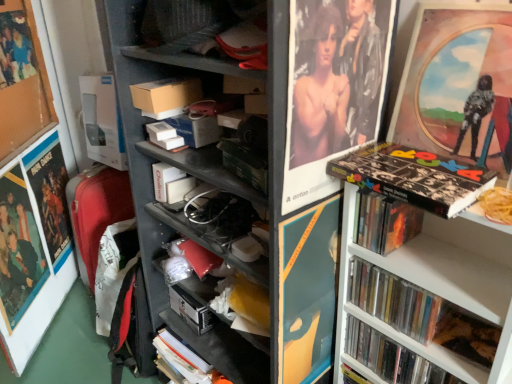
This screenshot has width=512, height=384. What do you see at coordinates (190, 310) in the screenshot?
I see `hardcover book at center` at bounding box center [190, 310].

In order to face wooden frame poster at upper left, placed as the 3th poster page when sorted from right to left, should I rotate leftwards or rightwards?

A 29.565 degree turn to the left will do.

Describe the element at coordinates (22, 82) in the screenshot. I see `wooden frame poster at upper left, placed as the 3th poster page when sorted from right to left` at that location.

Image resolution: width=512 pixels, height=384 pixels. I want to click on white matte book at center, the fifth book viewed from the right, so click(x=170, y=183).

Image resolution: width=512 pixels, height=384 pixels. What do you see at coordinates (170, 183) in the screenshot?
I see `white matte book at center, the fifth book viewed from the right` at bounding box center [170, 183].

What do you see at coordinates (384, 222) in the screenshot? Image resolution: width=512 pixels, height=384 pixels. I see `hardcover book at upper right, which is the fourth book from right to left` at bounding box center [384, 222].

Locate an element on the screen. The width and height of the screenshot is (512, 384). matte black bookshelf at center is located at coordinates (151, 144).

Does point (398, 367) come closer to viewer compared to point (383, 310)?

No, it is behind (383, 310).

From the image's perspective, is black matte book at lower right, arranged as the fifth book when viewed from the left, located beneath metallic silver cd case at right, the 4th book in the left-to-right sequence?

Correct, black matte book at lower right, arranged as the fifth book when viewed from the left, appears lower than metallic silver cd case at right, the 4th book in the left-to-right sequence, in the image.

Considering the relative positions of black matte book at lower right, which is the first book in right-to-left order, and metallic silver cd case at right, positioned as the 2th book in right-to-left order, in the image provided, is black matte book at lower right, which is the first book in right-to-left order, to the left of metallic silver cd case at right, positioned as the 2th book in right-to-left order, from the viewer's perspective?

Incorrect, black matte book at lower right, which is the first book in right-to-left order, is not on the left side of metallic silver cd case at right, positioned as the 2th book in right-to-left order.

You are a GUI agent. You are given a task and a screenshot of the screen. Output one action in this format:
    pyautogui.click(x=<x>, y=<y>)
    Task: Click on the 1st book in front of the metallic silver cd case at right, positioned as the 2th book in right-to-left order, counting from the anchor's position
    This screenshot has width=512, height=384.
    Given the screenshot: What is the action you would take?
    pyautogui.click(x=391, y=357)

In the scene shown: Can you confirm if matte paper poster at left, marked as the 1th poster page in a right-to-left arrangement, is bigger than wooden frame poster at upper left, placed as the 3th poster page when sorted from right to left?

Yes.

This screenshot has height=384, width=512. In order to click on the 2nd poster page positioned below the wooden frame poster at upper left, marked as the 1th poster page in a left-to-right arrangement (from the image's perspective) in this screenshot , I will do `click(18, 249)`.

In the scene shown: Is matte paper poster at left, the third poster page from the left, not near wooden frame poster at upper left, placed as the 3th poster page when sorted from right to left?

Actually, matte paper poster at left, the third poster page from the left, and wooden frame poster at upper left, placed as the 3th poster page when sorted from right to left, are a little close together.

In the scene shown: Considering the relative positions of hardcover book at upper right, which is the fourth book from right to left, and wooden frame poster at upper left, placed as the 3th poster page when sorted from right to left, in the image provided, is hardcover book at upper right, which is the fourth book from right to left, to the left of wooden frame poster at upper left, placed as the 3th poster page when sorted from right to left, from the viewer's perspective?

No, hardcover book at upper right, which is the fourth book from right to left, is not to the left of wooden frame poster at upper left, placed as the 3th poster page when sorted from right to left.

Is hardcover book at upper right, which is the fourth book from right to left, located outside wooden frame poster at upper left, placed as the 3th poster page when sorted from right to left?

Yes.

In the image, is hardcover book at upper right, acting as the 2th book starting from the left, positioned in front of or behind wooden frame poster at upper left, marked as the 1th poster page in a left-to-right arrangement?

hardcover book at upper right, acting as the 2th book starting from the left, is in front of wooden frame poster at upper left, marked as the 1th poster page in a left-to-right arrangement.

From the image's perspective, is hardcover book at upper right, acting as the 2th book starting from the left, over wooden frame poster at upper left, marked as the 1th poster page in a left-to-right arrangement?

No.

Find the location of `book that is the 4th object located in front of the matte paper poster at left, marked as the 1th poster page in a right-to-left arrangement`. book that is the 4th object located in front of the matte paper poster at left, marked as the 1th poster page in a right-to-left arrangement is located at coordinates (391, 357).

Considering the sizes of objects black matte book at lower right, which is the first book in right-to-left order, and matte paper poster at left, the third poster page from the left, in the image provided, who is bigger, black matte book at lower right, which is the first book in right-to-left order, or matte paper poster at left, the third poster page from the left,?

With larger size is black matte book at lower right, which is the first book in right-to-left order.

Does point (387, 374) come closer to viewer compared to point (29, 231)?

Yes, point (387, 374) is closer to viewer.

Considering the relative positions of matte black poster at left, the 2th poster page when ordered from left to right, and metallic silver cd case at right, the 4th book in the left-to-right sequence, in the image provided, is matte black poster at left, the 2th poster page when ordered from left to right, behind metallic silver cd case at right, the 4th book in the left-to-right sequence,?

Yes, it is.

Could you tell me if matte black poster at left, the second poster page from the right, is turned towards metallic silver cd case at right, positioned as the 2th book in right-to-left order?

Yes.

Which poster page is the 1st one when counting from the back of the metallic silver cd case at right, the 4th book in the left-to-right sequence? Please provide its 2D coordinates.

[(33, 249)]

Is matte black poster at left, the second poster page from the right, situated inside metallic silver cd case at right, positioned as the 2th book in right-to-left order, or outside?

matte black poster at left, the second poster page from the right, is not enclosed by metallic silver cd case at right, positioned as the 2th book in right-to-left order.

The height and width of the screenshot is (384, 512). In order to click on magazine above the black matte book at lower right, arranged as the fifth book when viewed from the left (from a real-world perspective) in this screenshot , I will do `click(166, 96)`.

Would you say matte cardboard box at center is a long distance from black matte book at lower right, which is the first book in right-to-left order?

matte cardboard box at center is actually quite close to black matte book at lower right, which is the first book in right-to-left order.

In the image, is matte cardboard box at center positioned in front of or behind black matte book at lower right, arranged as the fifth book when viewed from the left?

matte cardboard box at center is behind black matte book at lower right, arranged as the fifth book when viewed from the left.

From a real-world perspective, is matte cardboard box at center over black matte book at lower right, which is the first book in right-to-left order?

Yes, from a real-world perspective, matte cardboard box at center is on top of black matte book at lower right, which is the first book in right-to-left order.

Is hardcover book at center touching wooden frame poster at upper left, marked as the 1th poster page in a left-to-right arrangement?

No, hardcover book at center is not touching wooden frame poster at upper left, marked as the 1th poster page in a left-to-right arrangement.

You are a GUI agent. You are given a task and a screenshot of the screen. Output one action in this format:
    pyautogui.click(x=<x>, y=<y>)
    Task: Click on the 2nd poster page behind when counting from the hardcover book at center
    The width and height of the screenshot is (512, 384).
    Given the screenshot: What is the action you would take?
    pyautogui.click(x=22, y=82)

Measure the distance from hardcover book at center to wooden frame poster at upper left, marked as the 1th poster page in a left-to-right arrangement.

They are 37.52 inches apart.

Is hardcover book at center to the left or to the right of wooden frame poster at upper left, placed as the 3th poster page when sorted from right to left, in the image?

In the image, hardcover book at center appears on the right side of wooden frame poster at upper left, placed as the 3th poster page when sorted from right to left.

Starting from the black matte book at lower right, arranged as the fifth book when viewed from the left, which book is the 1st one behind? Please provide its 2D coordinates.

[(393, 300)]

Starting from the matte paper poster at left, the third poster page from the left, which poster page is the 2nd one to the left? Please provide its 2D coordinates.

[(22, 82)]

Estimate the real-world distances between objects in this image. Which object is closer to metallic silver cd case at right, the 4th book in the left-to-right sequence, matte plastic picture frame at upper right, the 2th picture frame from the left, or matte cardboard box at center?

matte plastic picture frame at upper right, the 2th picture frame from the left.

Looking at the image, which one is located closer to matte plastic picture frame at upper right, the first picture frame positioned from the right, hardcover book at center or matte paper poster at left, the third poster page from the left?

hardcover book at center is positioned closer to the anchor matte plastic picture frame at upper right, the first picture frame positioned from the right.

Based on their spatial positions, is black matte book at lower right, arranged as the fifth book when viewed from the left, or matte paper poster at left, marked as the 1th poster page in a right-to-left arrangement, closer to matte black poster at left, the 2th poster page when ordered from left to right?

The object closer to matte black poster at left, the 2th poster page when ordered from left to right, is matte paper poster at left, marked as the 1th poster page in a right-to-left arrangement.

From the image, which object appears to be farther from wooden frame poster at upper left, placed as the 3th poster page when sorted from right to left, black matte book at upper right, arranged as the 3th book when viewed from the right, or matte black bookshelf at center?

Among the two, black matte book at upper right, arranged as the 3th book when viewed from the right, is located further to wooden frame poster at upper left, placed as the 3th poster page when sorted from right to left.

Consider the image. Considering their positions, is black matte book at lower right, arranged as the fifth book when viewed from the left, positioned closer to hardcover book at upper right, which is the fourth book from right to left, than matte black poster at left, the second poster page from the right?

The object closer to hardcover book at upper right, which is the fourth book from right to left, is black matte book at lower right, arranged as the fifth book when viewed from the left.

Based on the photo, when comparing their distances from matte paper poster at upper center, arranged as the 2th picture frame when viewed from the right, does black matte book at upper right, arranged as the 3th book when viewed from the right, or matte cardboard box at center seem further?

matte cardboard box at center.

When comparing their distances from black matte book at lower right, which is the first book in right-to-left order, does hardcover book at upper right, which is the fourth book from right to left, or matte cardboard box at center seem closer?

Among the two, hardcover book at upper right, which is the fourth book from right to left, is located nearer to black matte book at lower right, which is the first book in right-to-left order.

Estimate the real-world distances between objects in this image. Which object is further from matte cardboard box at center, matte plastic picture frame at upper right, the 2th picture frame from the left, or matte black bookshelf at center?

matte plastic picture frame at upper right, the 2th picture frame from the left.

Locate an element on the screen. The height and width of the screenshot is (384, 512). poster page situated between matte black poster at left, the second poster page from the right, and hardcover book at center from left to right is located at coordinates (18, 249).

Find the location of a particular element. The image size is (512, 384). paperback book located between matte black poster at left, the second poster page from the right, and black matte book at lower right, which is the first book in right-to-left order, in the left-right direction is located at coordinates pyautogui.click(x=190, y=310).

At what (x,y) coordinates should I click in order to perform the action: click on paperback book between matte paper poster at left, marked as the 1th poster page in a right-to-left arrangement, and hardcover book at upper right, acting as the 2th book starting from the left, from left to right. Please return your answer as a coordinate pair (x, y). The image size is (512, 384). Looking at the image, I should click on pyautogui.click(x=190, y=310).

Locate an element on the screen. The height and width of the screenshot is (384, 512). bookshelf between matte black poster at left, the second poster page from the right, and black matte book at upper right, the third book viewed from the left, from left to right is located at coordinates [x=151, y=144].